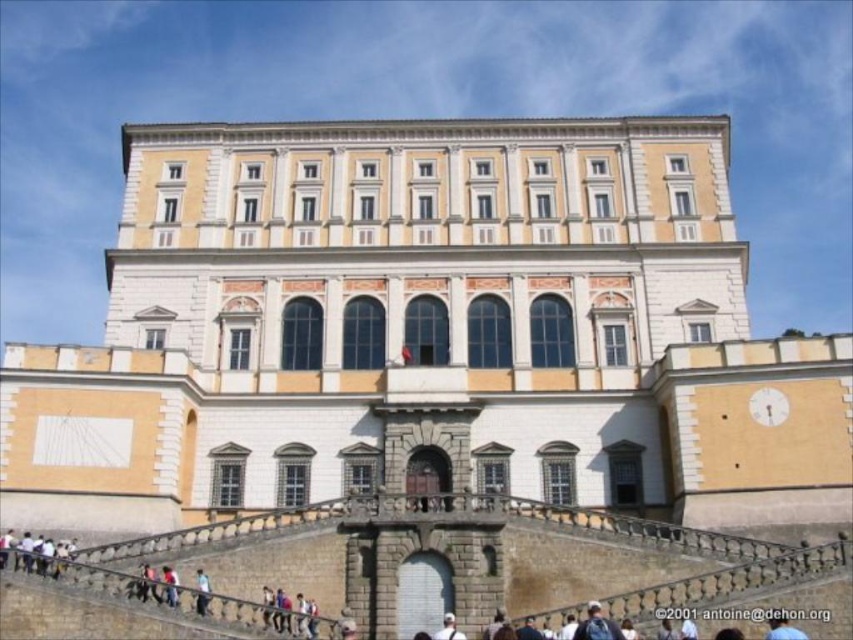
Does light blue jeans at lower center have a lesser height compared to white fabric cap at upper center?

No, light blue jeans at lower center is not shorter than white fabric cap at upper center.

Is point (175, 593) farther from viewer compared to point (447, 621)?

Yes, point (175, 593) is farther from viewer.

Is point (163, 572) closer to viewer compared to point (442, 628)?

That is True.

Locate an element on the screen. light blue jeans at lower center is located at coordinates (170, 586).

Does point (799, 630) come closer to viewer compared to point (202, 586)?

Yes, point (799, 630) is in front of point (202, 586).

Find the location of `blue fabric at center`. blue fabric at center is located at coordinates (782, 627).

Locate an element on the screen. This screenshot has height=640, width=853. blue fabric at center is located at coordinates (782, 627).

Does blue fabric at center appear on the right side of white fabric cap at upper center?

Indeed, blue fabric at center is positioned on the right side of white fabric cap at upper center.

Does blue fabric at center have a greater height compared to white fabric cap at upper center?

Correct, blue fabric at center is much taller as white fabric cap at upper center.

Which is in front, point (776, 637) or point (444, 618)?

Positioned in front is point (776, 637).

Where is `blue fabric at center`? The width and height of the screenshot is (853, 640). blue fabric at center is located at coordinates (782, 627).